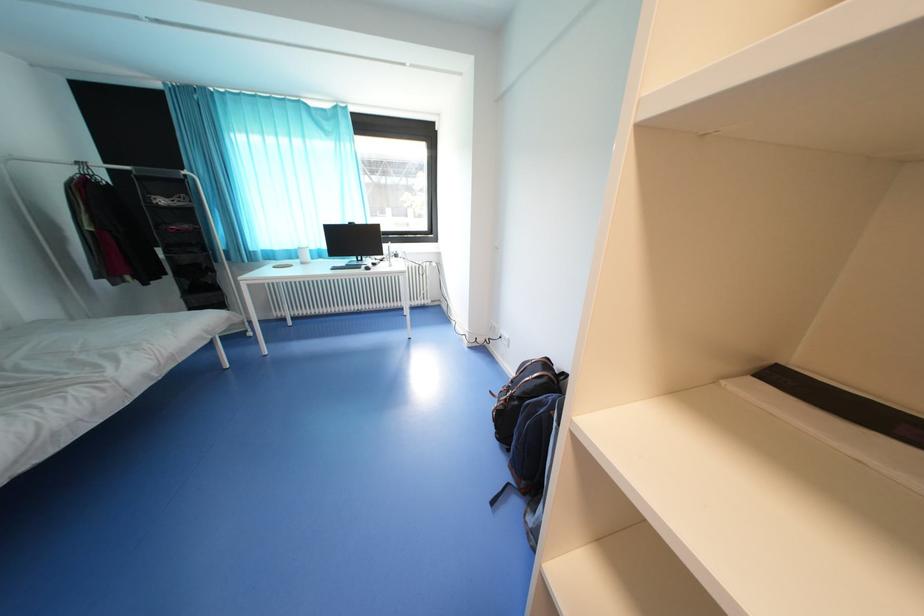
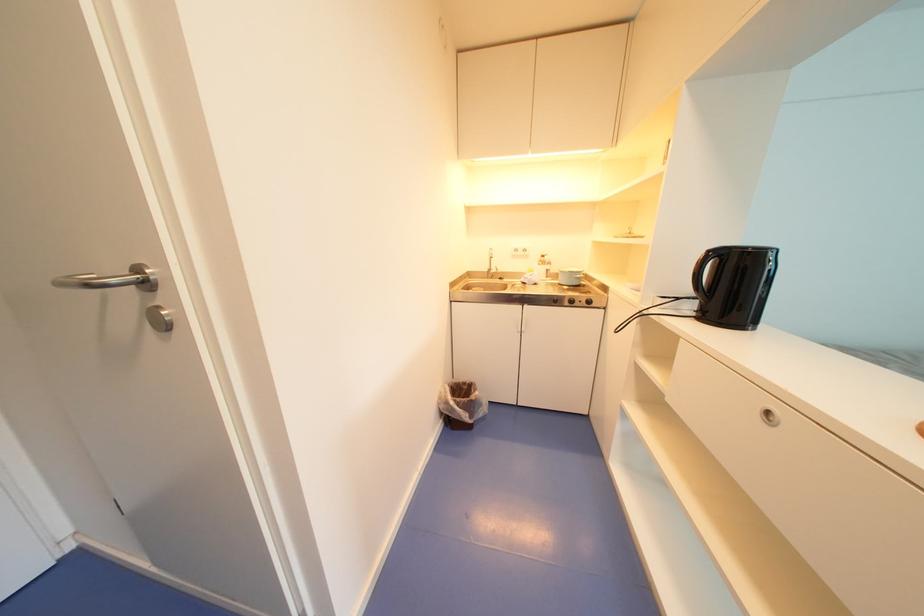
The images are taken continuously from a first-person perspective. In which direction is your viewpoint rotating?

The camera's rotation is toward left-down.